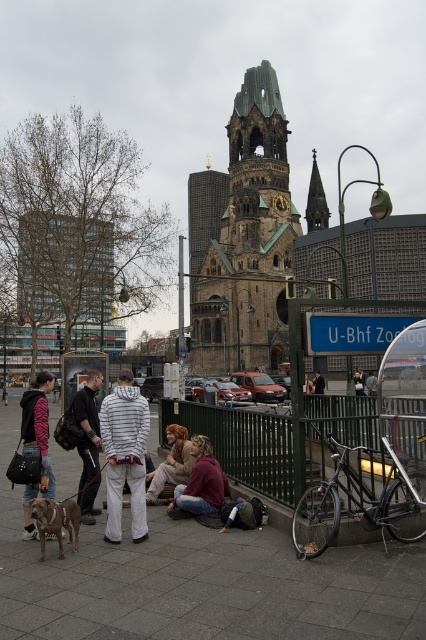
Which is behind, point (32, 403) or point (158, 483)?

Point (158, 483)

You are a GUI agent. You are given a task and a screenshot of the screen. Output one action in this format:
    pyautogui.click(x=<x>, y=<y>)
    Task: Click on the zebra print hoodie at lower left
    
    Given the screenshot: What is the action you would take?
    pyautogui.click(x=36, y=444)

Who is more distant from viewer, [180,428] or [325,384]?

Positioned behind is point [325,384].

Which is below, brown hair at center or dark brown leather jacket at center?

brown hair at center is lower down.

Who is more distant from viewer, (186,458) or (316,372)?

Positioned behind is point (316,372).

Where is `brown hair at center`? The width and height of the screenshot is (426, 640). brown hair at center is located at coordinates (170, 464).

Which is more to the left, white striped hoodie at center or jeans at center?

white striped hoodie at center is more to the left.

Consider the image. Does white striped hoodie at center have a lesser width compared to jeans at center?

Yes.

Identify the location of white striped hoodie at center. (124, 456).